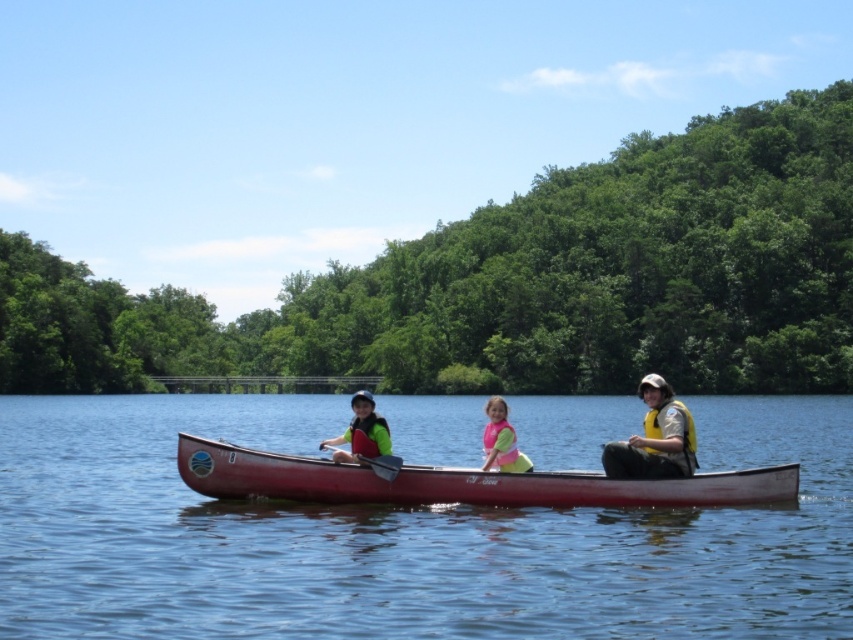
You are a photographer trying to capture the entire scene of the smooth blue water at center and the matte green life vest at center in one shot. Based on their widths, which object will require you to adjust your camera angle to include more of its area in the photo?

The smooth blue water at center has a greater width than the matte green life vest at center, so you will need to adjust your camera angle to include more of the smooth blue water at center in the photo.

You are a photographer standing on the shore of a lake. You want to take a photo of the smooth blue water at center and the matte green life vest at center in the same frame. The camera you are using has a maximum focus range of 30 meters. Can both objects be captured clearly in the same photo?

The smooth blue water at center and the matte green life vest at center are 29.02 meters apart. Since the distance between them is within the camera maximum focus range of 30 meters, both objects can be captured clearly in the same photo.

You are standing on the shore and see two points marked on the canoe. The first point is at position point (345,513) and the second point is at point (491,444). Which point is closer to the front of the canoe?

Point (345,513) is in front of point (491,444), so it is closer to the front of the canoe.